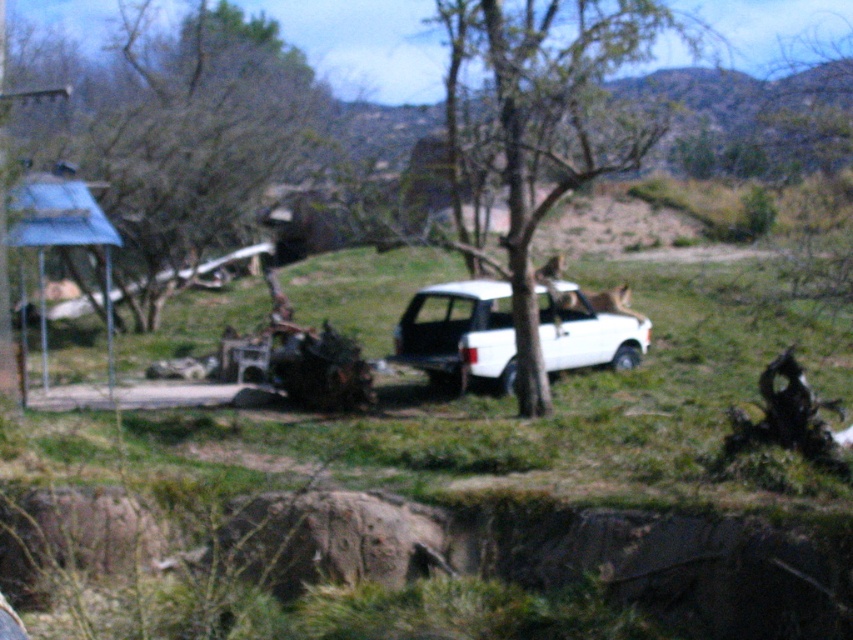
You are a hiker trying to estimate distances in the scene. You see the brown bark tree at center and the white matte suv at center. Which object appears closer to you based on their sizes?

The brown bark tree at center appears closer because it is smaller in size compared to the white matte suv at center, which suggests it is farther away due to perspective.

Consider the image. You are standing at the position of the white vehicle parked on a grassy area and want to walk directly towards the brown bark tree at center. According to the coordinates given, in which direction should you head?

The brown bark tree at center is located at coordinates 0.200 on the x axis and 0.660 on the y axis. Since the x coordinate is less than 0.5, you should head to the left. The y coordinate is greater than 0.5, so you should also move forward. Therefore, you should head diagonally to the left and forward to reach the brown bark tree at center.